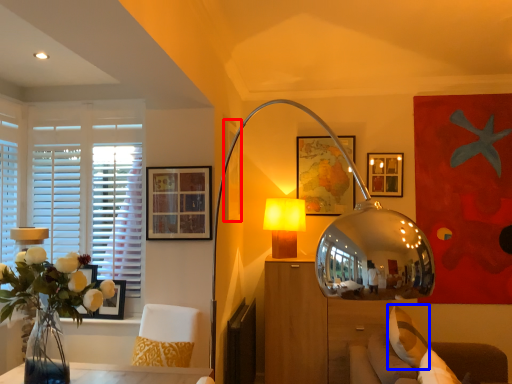
Question: Which object appears farthest to the camera in this image, picture frame (highlighted by a red box) or pillow (highlighted by a blue box)?

Choices:
 (A) picture frame
 (B) pillow

Answer: (A)